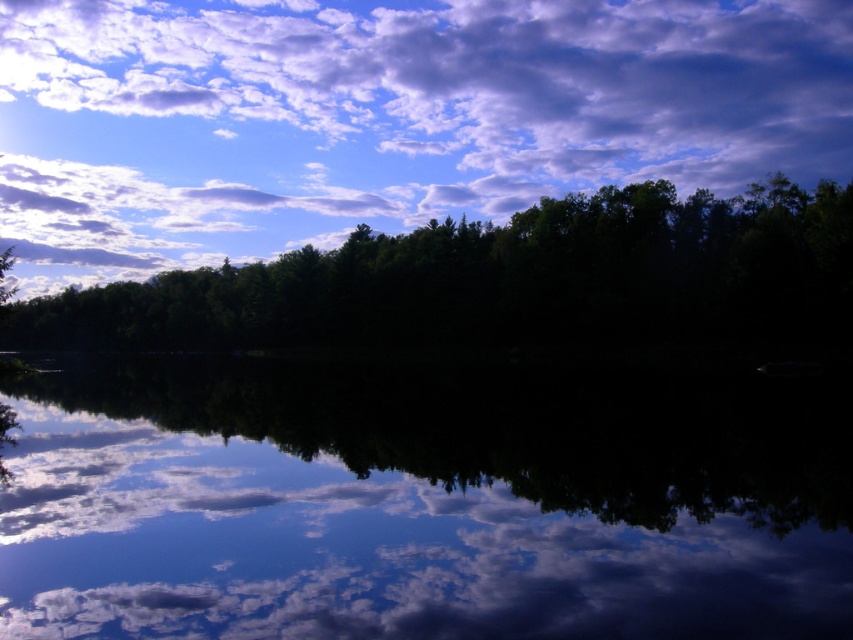
Question: Can you confirm if white fluffy cloud at upper center is positioned above green matte forest at center?

Choices:
 (A) yes
 (B) no

Answer: (A)

Question: Observing the image, what is the correct spatial positioning of white fluffy cloud at upper center in reference to green matte forest at center?

Choices:
 (A) below
 (B) above

Answer: (B)

Question: Which of the following is the closest to the observer?

Choices:
 (A) (141, 259)
 (B) (666, 289)
 (C) (836, 596)

Answer: (C)

Question: Estimate the real-world distances between objects in this image. Which object is closer to the white fluffy cloud at upper center?

Choices:
 (A) green matte forest at center
 (B) transparent glass water at center

Answer: (A)

Question: Is transparent glass water at center smaller than green matte forest at center?

Choices:
 (A) no
 (B) yes

Answer: (B)

Question: Based on their relative distances, which object is farther from the green matte forest at center?

Choices:
 (A) white fluffy cloud at upper center
 (B) transparent glass water at center

Answer: (A)